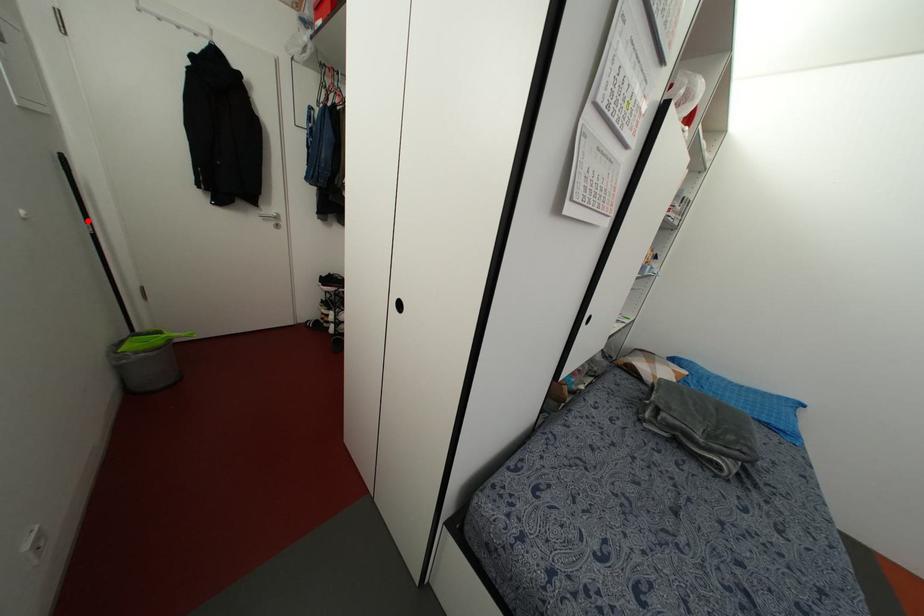
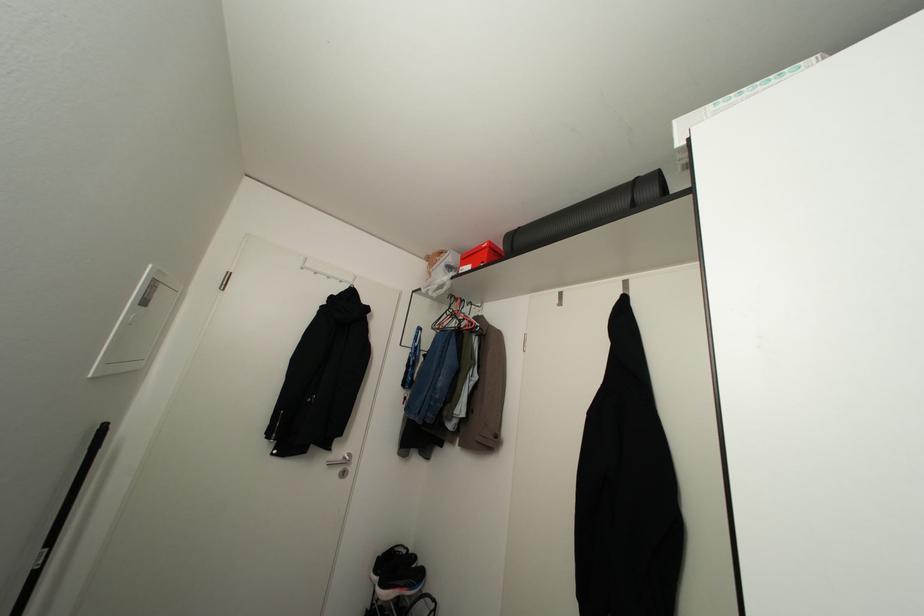
Question: A red point is marked in image1. In image2, is the corresponding 3D point closer to the camera or farther? Reply with the corresponding letter.

Choices:
 (A) The corresponding 3D point is closer.
 (B) The corresponding 3D point is farther.

Answer: (B)